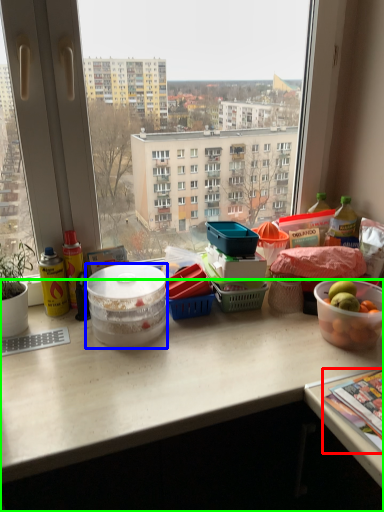
Question: Which is nearer to the magazine (highlighted by a red box)? bowl (highlighted by a blue box) or desk (highlighted by a green box).

Choices:
 (A) bowl
 (B) desk

Answer: (B)